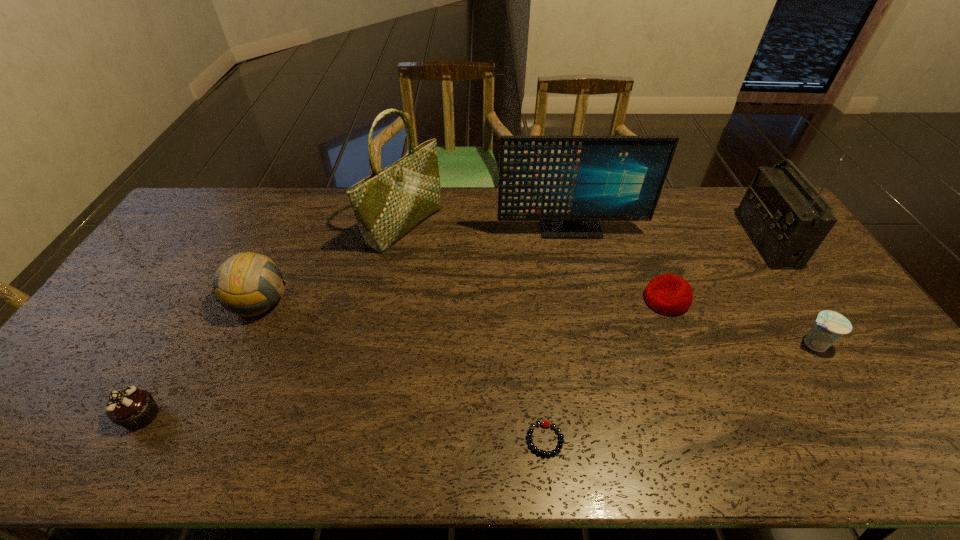
Where is `free space located 0.330m on the right of the bracelet`? This screenshot has width=960, height=540. free space located 0.330m on the right of the bracelet is located at coordinates (708, 440).

This screenshot has width=960, height=540. Find the location of `shopping bag at the far edge`. shopping bag at the far edge is located at coordinates (389, 203).

The width and height of the screenshot is (960, 540). Find the location of `radio receiver that is at the far edge`. radio receiver that is at the far edge is located at coordinates (786, 222).

The image size is (960, 540). I want to click on computer monitor present at the far edge, so click(x=569, y=183).

At what (x,y) coordinates should I click in order to perform the action: click on cupcake present at the near edge. Please return your answer as a coordinate pair (x, y). The height and width of the screenshot is (540, 960). Looking at the image, I should click on (132, 408).

Find the location of a particular element. This screenshot has height=540, width=960. bracelet that is positioned at the near edge is located at coordinates (544, 423).

Where is `radio receiver at the right edge`? Image resolution: width=960 pixels, height=540 pixels. radio receiver at the right edge is located at coordinates (786, 222).

This screenshot has width=960, height=540. I want to click on yogurt present at the right edge, so click(x=830, y=326).

What are the coordinates of `object that is at the far right corner` in the screenshot? It's located at (786, 222).

I want to click on vacant space at the far edge, so click(x=272, y=194).